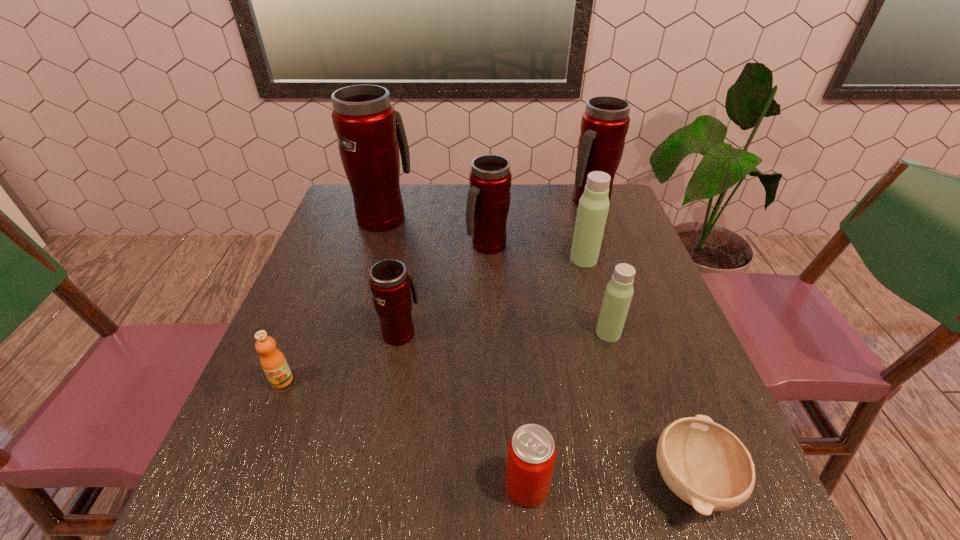
I want to click on orange juice, so click(273, 362).

At what (x,y) coordinates should I click in order to perform the action: click on can. Please return your answer as a coordinate pair (x, y). The width and height of the screenshot is (960, 540). Looking at the image, I should click on (531, 457).

The width and height of the screenshot is (960, 540). What are the coordinates of `the shortest object` in the screenshot? It's located at (703, 463).

This screenshot has height=540, width=960. Find the location of `beige bowl`. beige bowl is located at coordinates (703, 463).

Where is `vacant region located 0.090m on the side with the handle of the tallest thermos bottle`? This screenshot has width=960, height=540. vacant region located 0.090m on the side with the handle of the tallest thermos bottle is located at coordinates (393, 187).

Locate an element on the screen. Image resolution: width=960 pixels, height=540 pixels. free space located 0.060m on the side with the handle of the tallest thermos bottle is located at coordinates 392,191.

Where is `free space located on the side with the handle of the second tallest object`? free space located on the side with the handle of the second tallest object is located at coordinates (610, 260).

The height and width of the screenshot is (540, 960). In order to click on free space located on the side with the handle of the third biggest red thermos bottle in this screenshot , I will do `click(489, 296)`.

In order to click on vacant space located 0.190m on the left of the bigger light thermos bottle in this screenshot , I will do `click(497, 259)`.

You are a GUI agent. You are given a task and a screenshot of the screen. Output one action in this format:
    pyautogui.click(x=<x>, y=<y>)
    Task: Click on the free space located on the side with the handle of the smallest red thermos bottle
    The width and height of the screenshot is (960, 540).
    Given the screenshot: What is the action you would take?
    pyautogui.click(x=409, y=285)